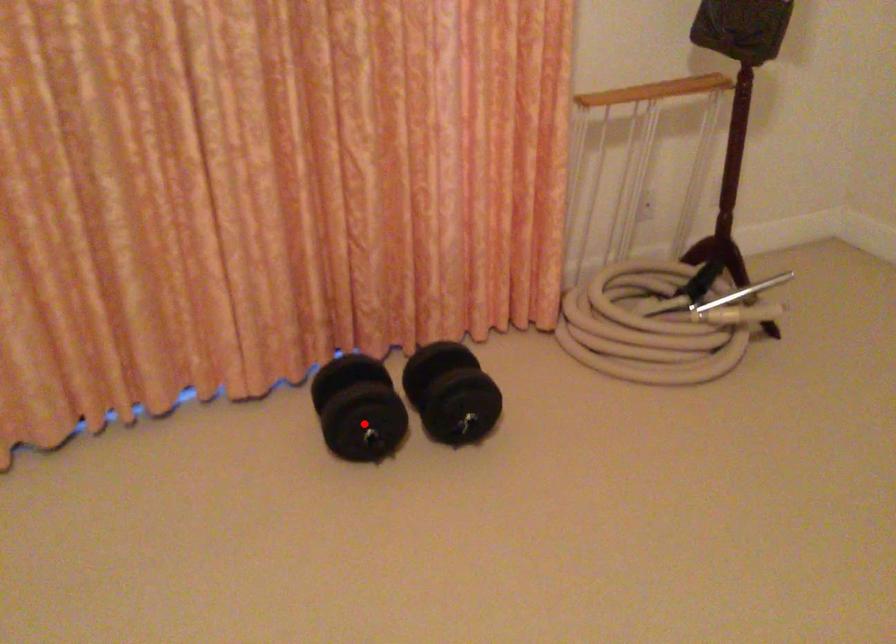
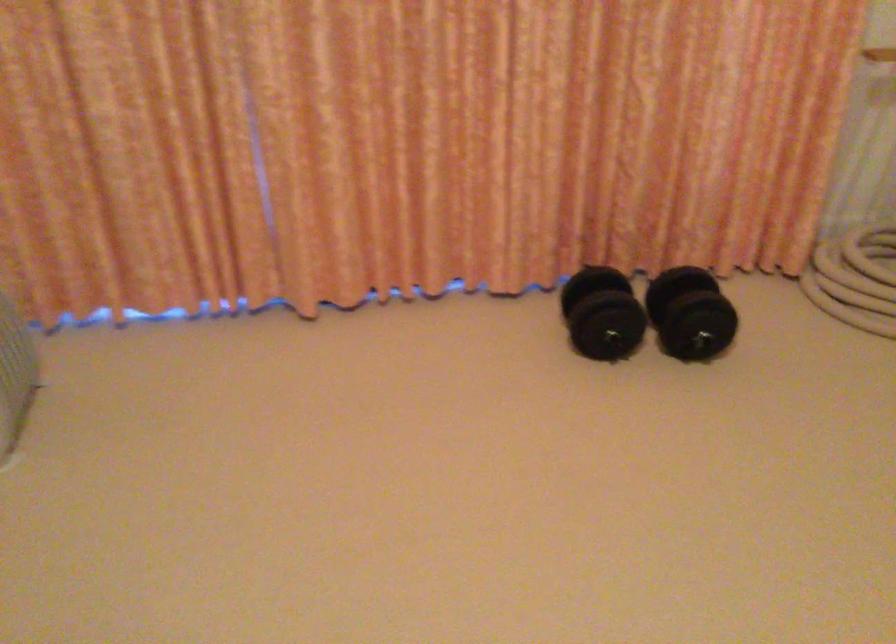
Where in the second image is the point corresponding to the highlighted location from the first image?

(606, 326)